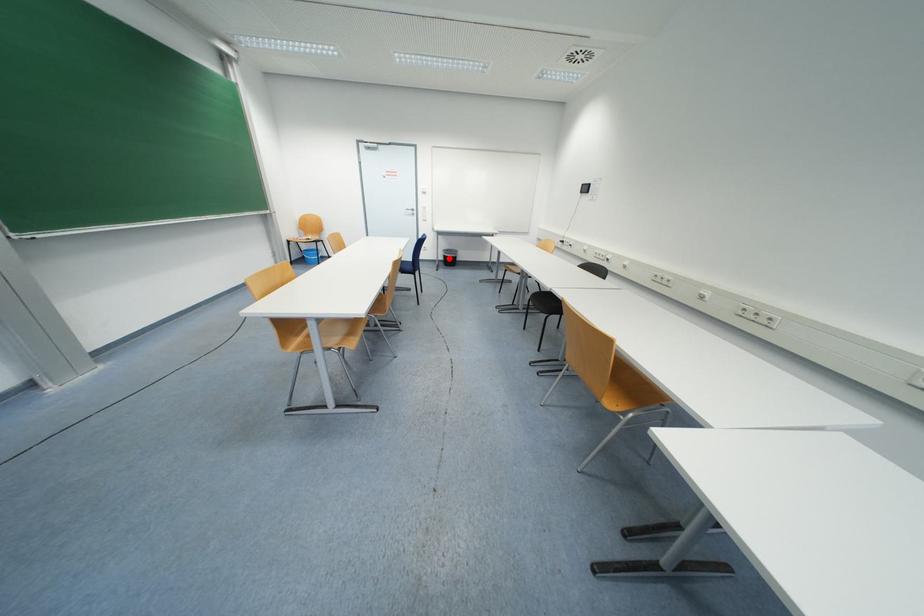
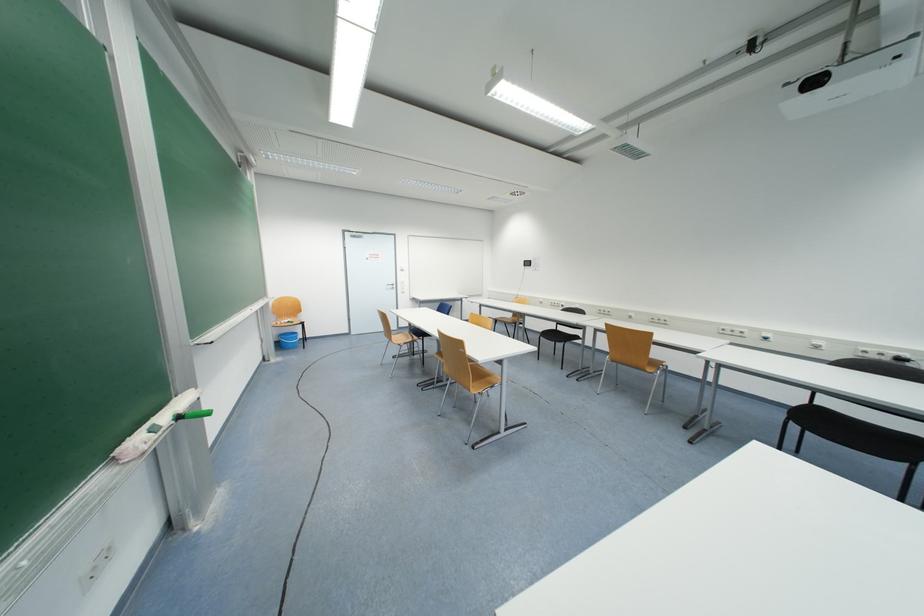
Question: I am providing you with two images of the same scene from different viewpoints. A red point is marked on the first image. Can you still see the location of the red point in image 2?

Choices:
 (A) Yes
 (B) No

Answer: (B)